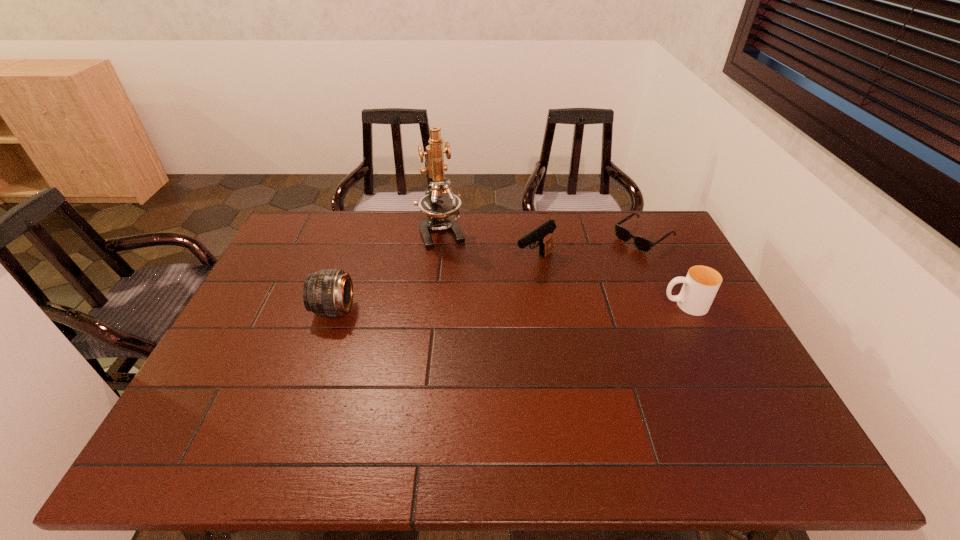
I want to click on vacant space at the near left corner of the desktop, so [x=218, y=414].

The width and height of the screenshot is (960, 540). I want to click on free space between the telephoto lens and the third object from right to left, so click(435, 286).

Find the location of a particular element. empty space between the third object from left to right and the sunglasses is located at coordinates (589, 249).

This screenshot has width=960, height=540. I want to click on vacant space that's between the cup and the second object from left to right, so click(564, 268).

Find the location of a particular element. The image size is (960, 540). unoccupied position between the shortest object and the cup is located at coordinates (664, 271).

The width and height of the screenshot is (960, 540). What are the coordinates of `vacant point located between the pistol and the tallest object` in the screenshot? It's located at (489, 246).

The width and height of the screenshot is (960, 540). Identify the location of vacant area between the pistol and the fourth tallest object. (610, 283).

The image size is (960, 540). In order to click on vacant region between the third object from right to left and the cup in this screenshot , I will do `click(610, 283)`.

The width and height of the screenshot is (960, 540). I want to click on unoccupied area between the cup and the leftmost object, so click(x=510, y=307).

In order to click on vacant area that lies between the third object from right to left and the shortest object in this screenshot , I will do `click(589, 249)`.